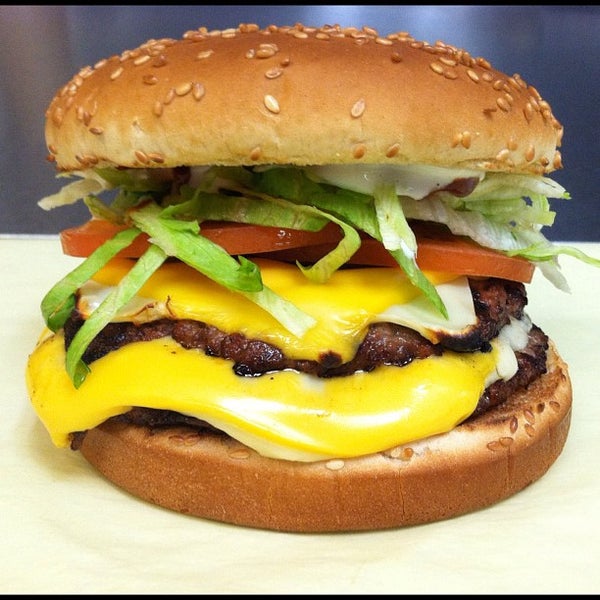
You are a GUI agent. You are given a task and a screenshot of the screen. Output one action in this format:
    pyautogui.click(x=<x>, y=<y>)
    Task: Click on the wall
    Image resolution: width=600 pixels, height=600 pixels.
    Given the screenshot: What is the action you would take?
    pyautogui.click(x=59, y=33)